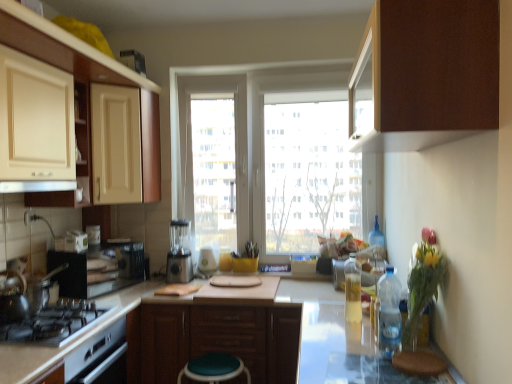
Question: Is white glossy exhaust hood at upper center positioned with its back to black matte gas stove at lower left?

Choices:
 (A) no
 (B) yes

Answer: (A)

Question: Is white glossy exhaust hood at upper center located outside black matte gas stove at lower left?

Choices:
 (A) yes
 (B) no

Answer: (A)

Question: Considering the relative positions of white glossy exhaust hood at upper center and black matte gas stove at lower left in the image provided, is white glossy exhaust hood at upper center to the left of black matte gas stove at lower left from the viewer's perspective?

Choices:
 (A) no
 (B) yes

Answer: (B)

Question: Is white glossy exhaust hood at upper center at the right side of black matte gas stove at lower left?

Choices:
 (A) no
 (B) yes

Answer: (A)

Question: Considering the relative positions of white glossy exhaust hood at upper center and black matte gas stove at lower left in the image provided, is white glossy exhaust hood at upper center in front of black matte gas stove at lower left?

Choices:
 (A) yes
 (B) no

Answer: (B)

Question: From the image's perspective, is translucent plastic bottle at center, the first bottle positioned from the left, positioned above or below clear plastic bottle at center, the third bottle from the back?

Choices:
 (A) below
 (B) above

Answer: (A)

Question: In terms of height, does translucent plastic bottle at center, positioned as the 4th bottle in front-to-back order, look taller or shorter compared to clear plastic bottle at center, which is the 2th bottle from front to back?

Choices:
 (A) tall
 (B) short

Answer: (B)

Question: Do you think translucent plastic bottle at center, positioned as the 4th bottle in front-to-back order, is within clear plastic bottle at center, which is the 2th bottle from front to back, or outside of it?

Choices:
 (A) outside
 (B) inside

Answer: (A)

Question: Visually, is translucent plastic bottle at center, the fourth bottle viewed from the right, positioned to the left or to the right of clear plastic bottle at center, which is counted as the third bottle, starting from the right?

Choices:
 (A) left
 (B) right

Answer: (A)

Question: Is matte cream cabinet at upper left, the 1th shelf positioned from the left, to the left or to the right of white glossy countertop at lower left in the image?

Choices:
 (A) right
 (B) left

Answer: (B)

Question: Does point (78, 170) appear closer or farther from the camera than point (48, 355)?

Choices:
 (A) closer
 (B) farther

Answer: (B)

Question: In terms of height, does matte cream cabinet at upper left, which is the second shelf in right-to-left order, look taller or shorter compared to white glossy countertop at lower left?

Choices:
 (A) short
 (B) tall

Answer: (A)

Question: From the image's perspective, relative to white glossy countertop at lower left, is matte cream cabinet at upper left, the 1th shelf positioned from the left, above or below?

Choices:
 (A) below
 (B) above

Answer: (B)

Question: In terms of width, does brown matte cabinet at upper right, acting as the 1th cabinetry starting from the top, look wider or thinner when compared to brown matte cabinet at center, the 3th cabinetry positioned from the top?

Choices:
 (A) thin
 (B) wide

Answer: (A)

Question: Considering their positions, is brown matte cabinet at upper right, acting as the 1th cabinetry starting from the top, located in front of or behind brown matte cabinet at center, marked as the first cabinetry in a back-to-front arrangement?

Choices:
 (A) front
 (B) behind

Answer: (A)